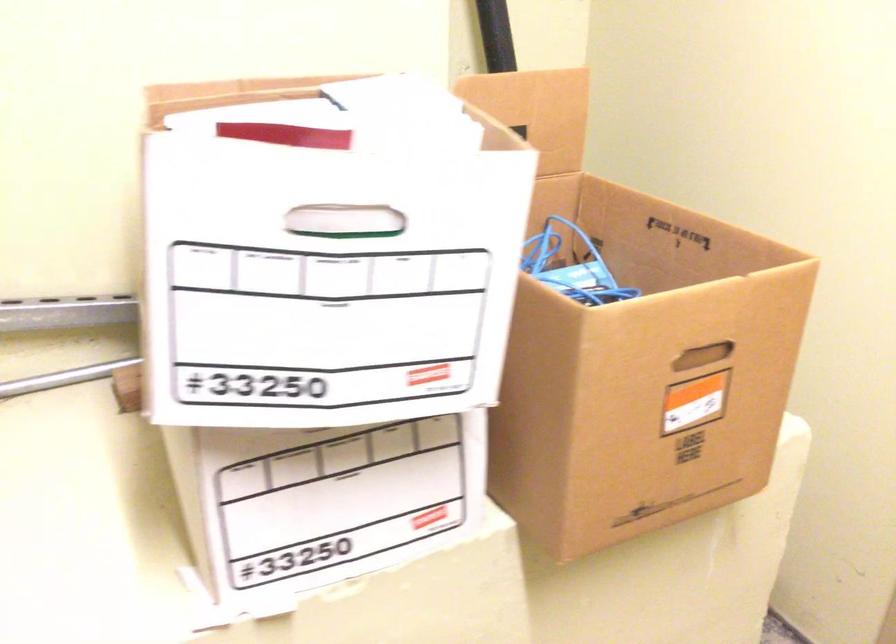
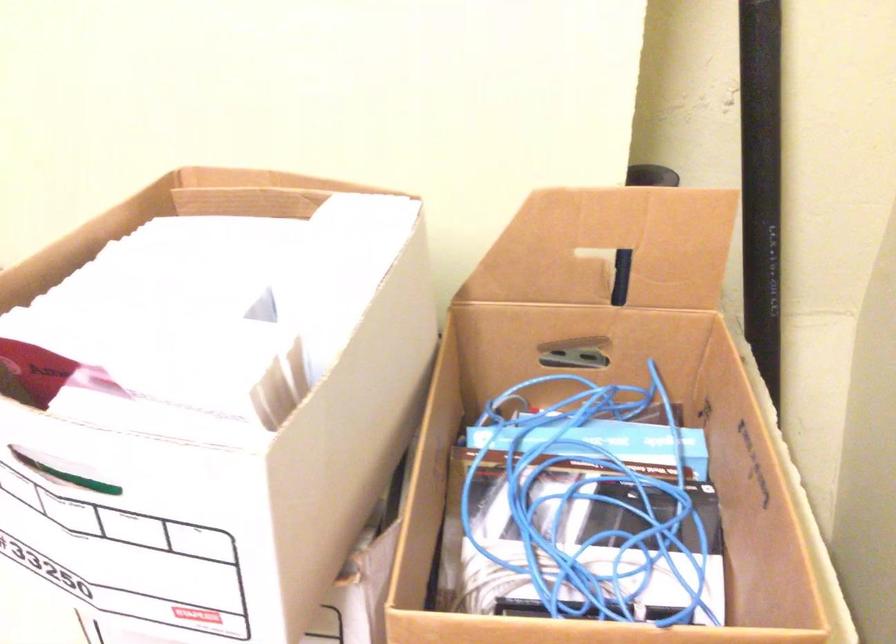
Locate, in the second image, the point that corresponds to [506,125] in the first image.

(609, 247)